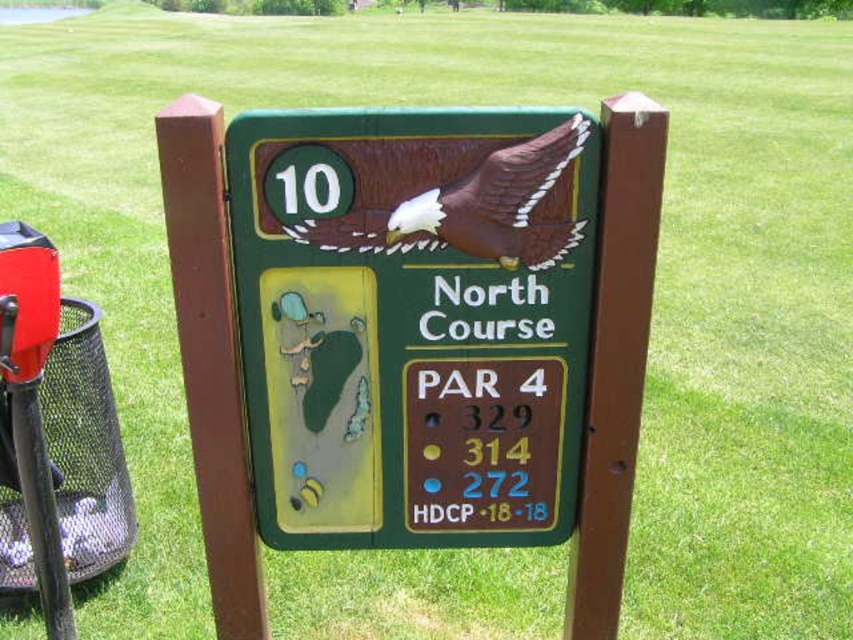
You are a golfer standing in front of the hole number 10 sign on the North Course. You notice the brown matte eagle at center and the brown wood post at center. Which object is closer to you?

The brown matte eagle at center is closer to you because it is further to the viewer than the brown wood post at center.

Looking at this image, you are a golfer standing in front of the green matte sign at center and the brown matte eagle at center. Which object would block your view more if you were to stand directly in front of them?

The green matte sign at center has a larger size compared to the brown matte eagle at center, so it would block your view more.

You are a golfer standing in front of the North Course sign. You need to determine if the green matte sign at center can be placed horizontally on a shelf that is 1.2 meters wide. The brown wood post at center is 0.3 meters in diameter. Can the sign fit?

The green matte sign at center might be wider than brown wood post at center. Since the brown wood post at center has a diameter of 0.3 meters, the sign could potentially be wider than 0.3 meters. However, without knowing the exact width of the sign, it is uncertain whether it will fit on the 1.2 meter shelf. Additional measurements are needed.